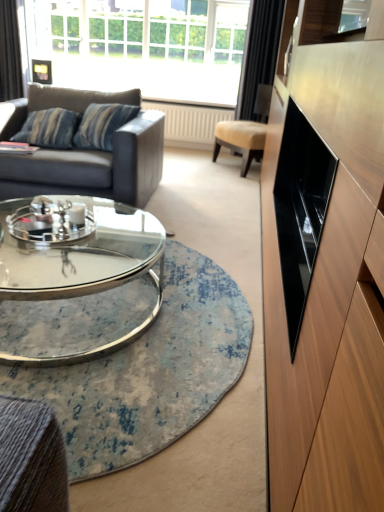
Question: Is white glass window at upper center shorter than clear glass coffee table at center?

Choices:
 (A) yes
 (B) no

Answer: (B)

Question: Is white glass window at upper center not within clear glass coffee table at center?

Choices:
 (A) no
 (B) yes

Answer: (B)

Question: From a real-world perspective, is white glass window at upper center on top of clear glass coffee table at center?

Choices:
 (A) yes
 (B) no

Answer: (A)

Question: Is white glass window at upper center facing towards clear glass coffee table at center?

Choices:
 (A) no
 (B) yes

Answer: (B)

Question: Would you say white glass window at upper center is a long distance from clear glass coffee table at center?

Choices:
 (A) no
 (B) yes

Answer: (B)

Question: From the image's perspective, is beige leather chair at center positioned above or below black velvet curtain at upper left, arranged as the 2th curtain when viewed from the right?

Choices:
 (A) above
 (B) below

Answer: (B)

Question: Is beige leather chair at center in front of or behind black velvet curtain at upper left, arranged as the 2th curtain when viewed from the right, in the image?

Choices:
 (A) front
 (B) behind

Answer: (A)

Question: Would you say beige leather chair at center is to the left or to the right of black velvet curtain at upper left, which is the first curtain in left-to-right order, in the picture?

Choices:
 (A) right
 (B) left

Answer: (A)

Question: Is beige leather chair at center bigger or smaller than black velvet curtain at upper left, which is the first curtain in left-to-right order?

Choices:
 (A) small
 (B) big

Answer: (B)

Question: From the image's perspective, is black velvet curtain at upper left, which is the first curtain in left-to-right order, positioned above or below dark gray leather couch at left?

Choices:
 (A) below
 (B) above

Answer: (B)

Question: Looking at the image, does black velvet curtain at upper left, which is the first curtain in left-to-right order, seem bigger or smaller compared to dark gray leather couch at left?

Choices:
 (A) small
 (B) big

Answer: (A)

Question: Is black velvet curtain at upper left, which is the first curtain in left-to-right order, spatially inside dark gray leather couch at left, or outside of it?

Choices:
 (A) outside
 (B) inside

Answer: (A)

Question: From a real-world perspective, is black velvet curtain at upper left, arranged as the 2th curtain when viewed from the right, physically located above or below dark gray leather couch at left?

Choices:
 (A) below
 (B) above

Answer: (B)

Question: From a real-world perspective, is black velvet curtain at upper left, arranged as the 2th curtain when viewed from the right, positioned above or below white glass window at upper center?

Choices:
 (A) below
 (B) above

Answer: (A)

Question: Considering the positions of black velvet curtain at upper left, which is the first curtain in left-to-right order, and white glass window at upper center in the image, is black velvet curtain at upper left, which is the first curtain in left-to-right order, bigger or smaller than white glass window at upper center?

Choices:
 (A) small
 (B) big

Answer: (A)